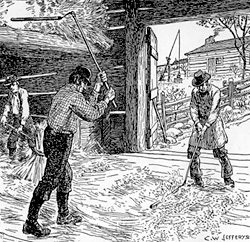
Image resolution: width=250 pixels, height=242 pixels. I want to click on floor, so click(x=169, y=158).